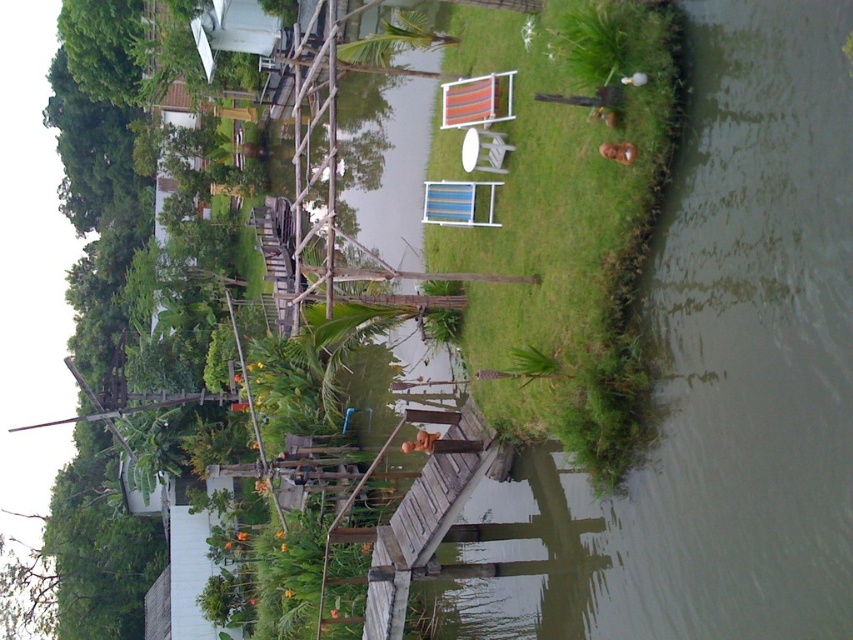
Is green grassy water at right in front of green grass at center?

Yes, green grassy water at right is in front of green grass at center.

Is green grassy water at right bigger than green grass at center?

Correct, green grassy water at right is larger in size than green grass at center.

Locate an element on the screen. Image resolution: width=853 pixels, height=640 pixels. green grassy water at right is located at coordinates (717, 374).